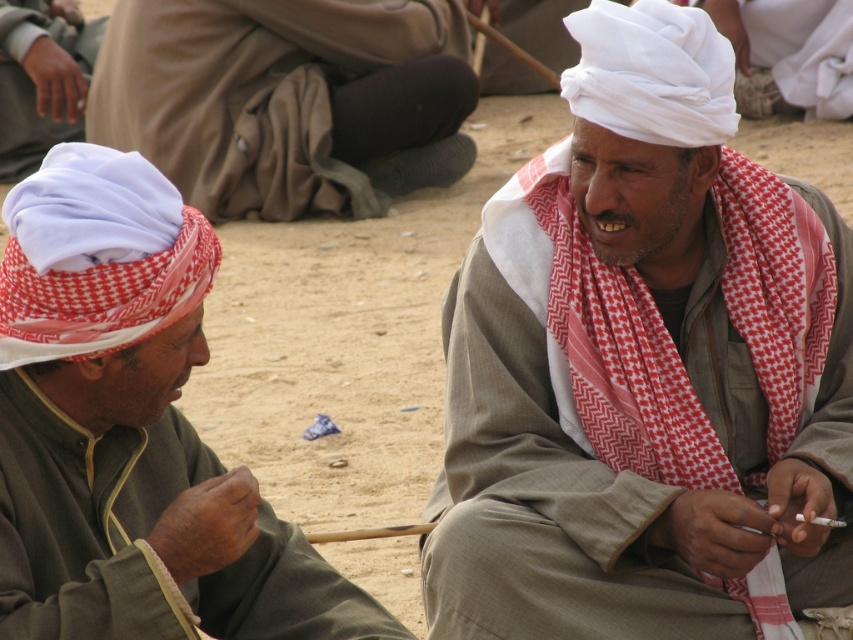
You are a traveler who just arrived in this desert area and see the two turbans, the white woven turban at center and the white cotton turban at upper left. Which one is located to the right of the other?

The white woven turban at center is positioned on the right side of the white cotton turban at upper left.

You are a traveler in the desert and need to decide which item to take for shade. The white cotton turban at upper left and the white cloth at upper left are available. Which one is taller and can provide better shade coverage?

The white cotton turban at upper left is much taller than the white cloth at upper left, so it can provide better shade coverage.